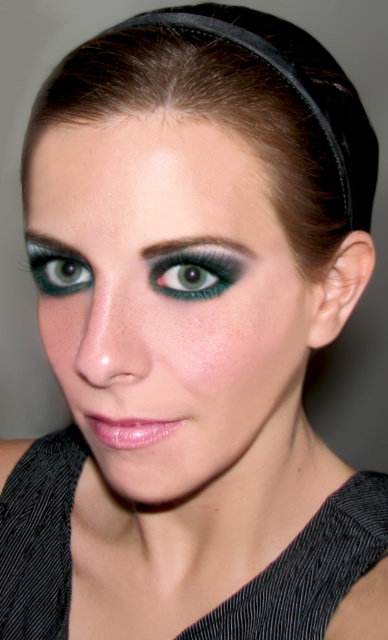
You are an artist trying to sketch the portrait. You want to draw the point at point [76,196] first. Should you draw it before or after the point at point [48,243]?

Point [76,196] is in front of point [48,243], so you should draw it first.

You are a makeup artist standing 10 inches away from a client. You need to apply the matte black eye makeup at center. Is your current distance sufficient to apply the makeup precisely?

The distance between the viewer and the matte black eye makeup at center is 9.62 inches. Since you are standing 10 inches away, your current distance is sufficient to apply the makeup precisely.

You are a makeup artist preparing to apply eyeliner for a client. The client has a neutral background and is positioned such that their face is at a close proximity to the camera. You notice the matte black eye makeup at center. Based on the distance provided, can you determine if you should use a fine or a bold eyeliner brush?

The matte black eye makeup at center is 9.62 inches from the viewer. Since this distance is relatively close, a fine eyeliner brush would allow for precise application to achieve the detailed and sharp winged eyeliner seen in the image.